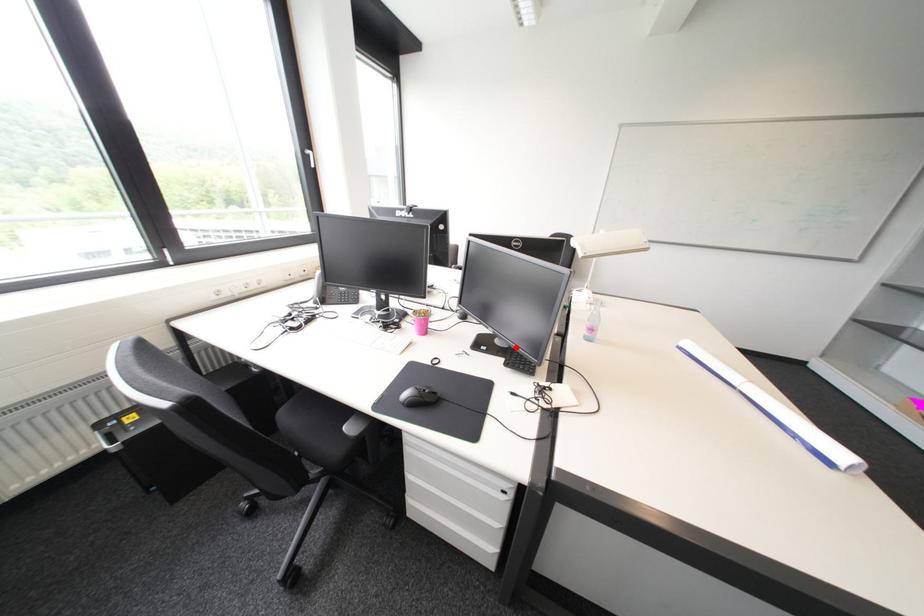
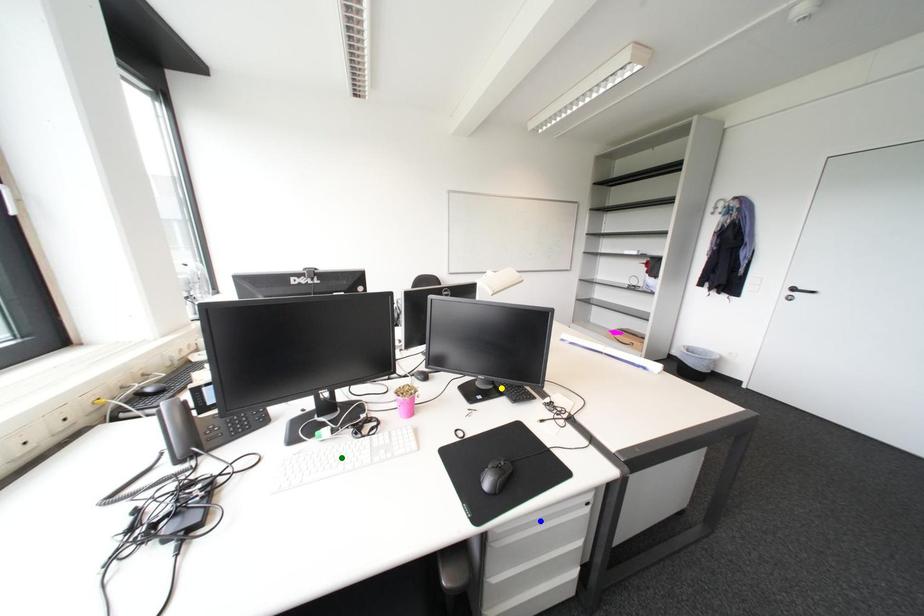
Question: I am providing you with two images of the same scene from different viewpoints. A red point is marked on the first image. You are given multiple points on the second image. In image 2, which mark is for the same physical point as the one in image 1?

Choices:
 (A) blue point
 (B) green point
 (C) yellow point

Answer: (C)